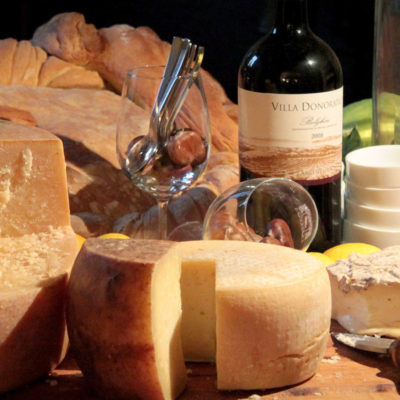
Find the location of a particular element. This screenshot has height=400, width=400. bowl is located at coordinates (365, 179).